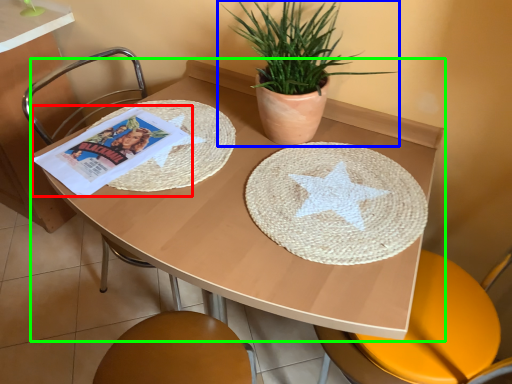
Question: Which object is positioned closest to comic book (highlighted by a red box)? Select from houseplant (highlighted by a blue box) and table (highlighted by a green box).

Choices:
 (A) houseplant
 (B) table

Answer: (B)